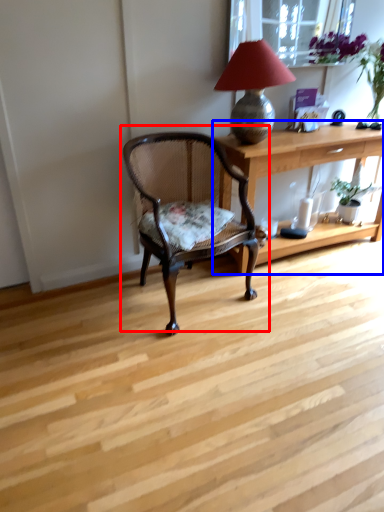
Question: Which object is closer to the camera taking this photo, chair (highlighted by a red box) or desk (highlighted by a blue box)?

Choices:
 (A) chair
 (B) desk

Answer: (A)